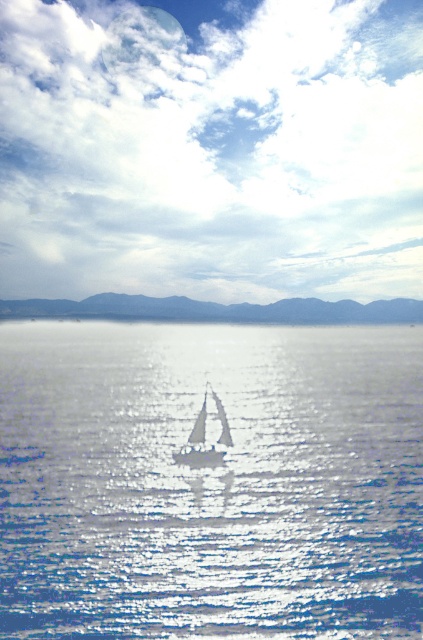
Between blue matte mountains at center and white matte sailboat at center, which one is positioned higher?

Positioned higher is blue matte mountains at center.

Between point (225, 317) and point (195, 467), which one is positioned in front?

Point (195, 467) is in front.

Locate an element on the screen. The height and width of the screenshot is (640, 423). blue matte mountains at center is located at coordinates click(x=219, y=308).

Which is in front, point (417, 628) or point (186, 461)?

Point (417, 628) is in front.

At what (x,y) coordinates should I click in order to perform the action: click on glistening blue water at center. Please return your answer as a coordinate pair (x, y). This screenshot has width=423, height=640. Looking at the image, I should click on (209, 483).

Between point (384, 401) and point (214, 465), which one is positioned in front?

Point (214, 465) is in front.

The width and height of the screenshot is (423, 640). In order to click on glistening blue water at center in this screenshot , I will do click(x=209, y=483).

Who is positioned more to the right, glistening blue water at center or blue matte mountains at center?

glistening blue water at center

Is glistening blue water at center wider than blue matte mountains at center?

In fact, glistening blue water at center might be narrower than blue matte mountains at center.

At what (x,y) coordinates should I click in order to perform the action: click on glistening blue water at center. Please return your answer as a coordinate pair (x, y). The height and width of the screenshot is (640, 423). Looking at the image, I should click on (209, 483).

At what (x,y) coordinates should I click in order to perform the action: click on glistening blue water at center. Please return your answer as a coordinate pair (x, y). Image resolution: width=423 pixels, height=640 pixels. Looking at the image, I should click on (209, 483).